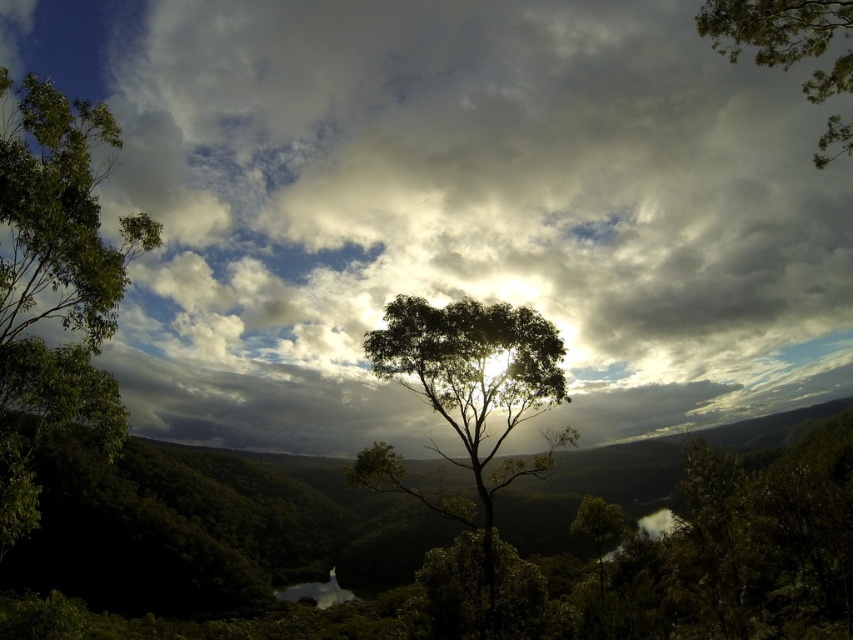
You are an artist trying to paint the scene. You notice the cloudy sky at upper center and the green leafy tree at center. Which one do you think occupies a larger area in the image?

The cloudy sky at upper center is wider than the green leafy tree at center, so it occupies a larger area in the image.

You are an artist sketching the landscape and want to ensure the cloudy sky at upper center and the green leafy tree at left are proportionally accurate. Which object should you draw first to maintain the correct size relationship between them?

The cloudy sky at upper center should be drawn first because it has a larger size compared to the green leafy tree at left, ensuring the proportions are maintained.

You are an artist trying to paint the scene. You want to ensure the cloudy sky at upper center and the green leafy tree at center are positioned correctly. Based on the scene description, which object should appear closer to the viewer?

The cloudy sky at upper center is in front of the green leafy tree at center, so it should appear closer to the viewer.